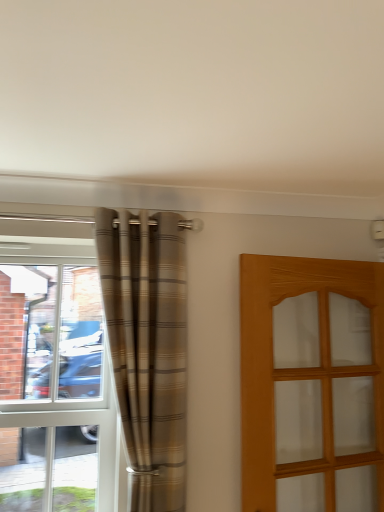
Question: Is plaid fabric curtain at left at the right side of light brown wooden door at right?

Choices:
 (A) no
 (B) yes

Answer: (A)

Question: Considering the relative sizes of plaid fabric curtain at left and light brown wooden door at right in the image provided, is plaid fabric curtain at left smaller than light brown wooden door at right?

Choices:
 (A) yes
 (B) no

Answer: (A)

Question: Does plaid fabric curtain at left have a greater width compared to light brown wooden door at right?

Choices:
 (A) yes
 (B) no

Answer: (A)

Question: Could you tell me if plaid fabric curtain at left is turned towards light brown wooden door at right?

Choices:
 (A) no
 (B) yes

Answer: (A)

Question: Is the position of plaid fabric curtain at left more distant than that of light brown wooden door at right?

Choices:
 (A) no
 (B) yes

Answer: (B)

Question: From a real-world perspective, is plaid fabric curtain at left under light brown wooden door at right?

Choices:
 (A) no
 (B) yes

Answer: (A)

Question: From a real-world perspective, is clear glass window at left physically below light brown wooden door at right?

Choices:
 (A) yes
 (B) no

Answer: (B)

Question: Is clear glass window at left bigger than light brown wooden door at right?

Choices:
 (A) no
 (B) yes

Answer: (A)

Question: Can you confirm if clear glass window at left is shorter than light brown wooden door at right?

Choices:
 (A) no
 (B) yes

Answer: (A)

Question: Can you confirm if clear glass window at left is smaller than light brown wooden door at right?

Choices:
 (A) no
 (B) yes

Answer: (B)

Question: From a real-world perspective, does clear glass window at left stand above light brown wooden door at right?

Choices:
 (A) no
 (B) yes

Answer: (B)

Question: Is clear glass window at left thinner than light brown wooden door at right?

Choices:
 (A) yes
 (B) no

Answer: (A)

Question: Can you confirm if clear glass window at left is bigger than plaid fabric curtain at left?

Choices:
 (A) no
 (B) yes

Answer: (A)